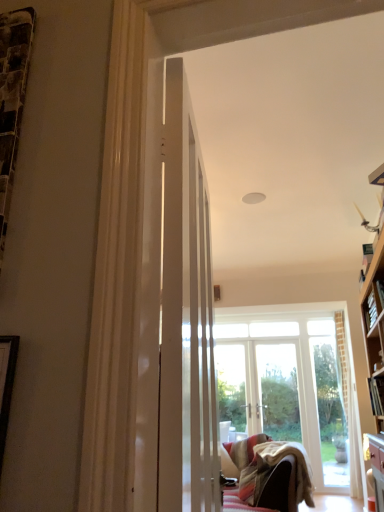
Question: Considering the relative sizes of velvet beige couch at lower center and white glossy door at center in the image provided, is velvet beige couch at lower center thinner than white glossy door at center?

Choices:
 (A) yes
 (B) no

Answer: (B)

Question: Is velvet beige couch at lower center shorter than white glossy door at center?

Choices:
 (A) no
 (B) yes

Answer: (B)

Question: From a real-world perspective, is velvet beige couch at lower center beneath white glossy door at center?

Choices:
 (A) yes
 (B) no

Answer: (A)

Question: Are velvet beige couch at lower center and white glossy door at center located far from each other?

Choices:
 (A) yes
 (B) no

Answer: (A)

Question: Is velvet beige couch at lower center looking in the opposite direction of white glossy door at center?

Choices:
 (A) yes
 (B) no

Answer: (B)

Question: From the image's perspective, relative to white glossy door at center, is velvet beige couch at lower center above or below?

Choices:
 (A) below
 (B) above

Answer: (A)

Question: From a real-world perspective, is velvet beige couch at lower center physically located above or below white glossy door at center?

Choices:
 (A) above
 (B) below

Answer: (B)

Question: In terms of width, does velvet beige couch at lower center look wider or thinner when compared to white glossy door at center?

Choices:
 (A) thin
 (B) wide

Answer: (B)

Question: Relative to white glossy door at center, is velvet beige couch at lower center in front or behind?

Choices:
 (A) front
 (B) behind

Answer: (B)

Question: From the image's perspective, relative to velvet beige couch at lower center, is white glossy door at center above or below?

Choices:
 (A) above
 (B) below

Answer: (A)

Question: From a real-world perspective, is white glossy door at center positioned above or below velvet beige couch at lower center?

Choices:
 (A) above
 (B) below

Answer: (A)

Question: Is white glossy door at center bigger or smaller than velvet beige couch at lower center?

Choices:
 (A) big
 (B) small

Answer: (B)

Question: Is white glossy door at center taller or shorter than velvet beige couch at lower center?

Choices:
 (A) short
 (B) tall

Answer: (B)

Question: Considering the relative positions of hardcover book at right, placed as the 1th book when sorted from bottom to top, and velvet beige couch at lower center in the image provided, is hardcover book at right, placed as the 1th book when sorted from bottom to top, to the left or to the right of velvet beige couch at lower center?

Choices:
 (A) left
 (B) right

Answer: (B)

Question: Based on their sizes in the image, would you say hardcover book at right, which ranks as the second book in top-to-bottom order, is bigger or smaller than velvet beige couch at lower center?

Choices:
 (A) big
 (B) small

Answer: (B)